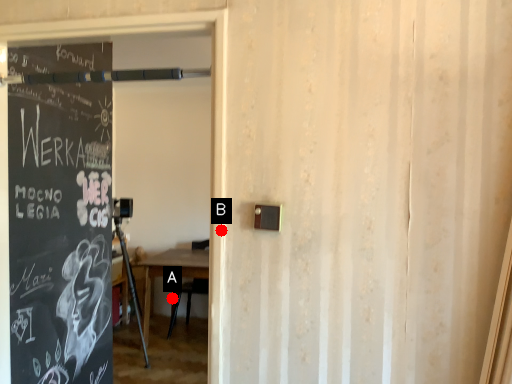
Question: Two points are circled on the image, labeled by A and B beside each circle. Which of the following is the farthest from the observer?

Choices:
 (A) A is further
 (B) B is further

Answer: (A)